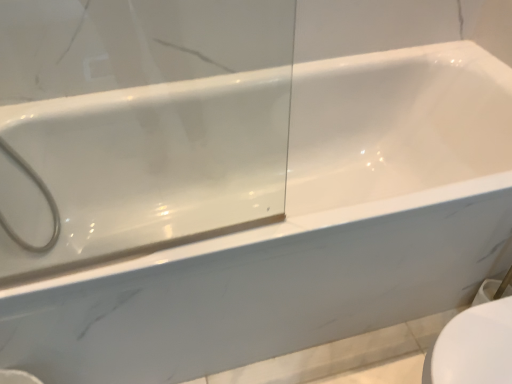
What do you see at coordinates (473, 347) in the screenshot? I see `white glossy toilet bowl at lower right` at bounding box center [473, 347].

Identify the location of white glossy toilet bowl at lower right. The image size is (512, 384). (473, 347).

What do you see at coordinates (44, 196) in the screenshot? I see `white matte showerhead at left` at bounding box center [44, 196].

The width and height of the screenshot is (512, 384). I want to click on white matte showerhead at left, so click(x=44, y=196).

Where is `white glossy toilet bowl at lower right`? The image size is (512, 384). white glossy toilet bowl at lower right is located at coordinates (473, 347).

Considering the positions of objects white matte showerhead at left and white glossy toilet bowl at lower right in the image provided, who is more to the left, white matte showerhead at left or white glossy toilet bowl at lower right?

From the viewer's perspective, white matte showerhead at left appears more on the left side.

Which object is closer to the camera taking this photo, white matte showerhead at left or white glossy toilet bowl at lower right?

white glossy toilet bowl at lower right is in front.

Which is in front, point (5, 224) or point (510, 378)?

The point (510, 378) is closer to the camera.

From the image's perspective, which one is positioned higher, white matte showerhead at left or white glossy toilet bowl at lower right?

white matte showerhead at left, from the image's perspective.

From a real-world perspective, which object stands above the other?

In real-world perspective, white matte showerhead at left is above.

Which of these two, white matte showerhead at left or white glossy toilet bowl at lower right, is thinner?

Thinner between the two is white matte showerhead at left.

Can you confirm if white matte showerhead at left is taller than white glossy toilet bowl at lower right?

Correct, white matte showerhead at left is much taller as white glossy toilet bowl at lower right.

Between white matte showerhead at left and white glossy toilet bowl at lower right, which one has smaller size?

With smaller size is white matte showerhead at left.

Is white matte showerhead at left completely or partially outside of white glossy toilet bowl at lower right?

Yes.

Would you consider white matte showerhead at left to be distant from white glossy toilet bowl at lower right?

Yes, white matte showerhead at left and white glossy toilet bowl at lower right are quite far apart.

Is white matte showerhead at left positioned with its back to white glossy toilet bowl at lower right?

No, white matte showerhead at left is not facing away from white glossy toilet bowl at lower right.

In order to click on shower behind the white glossy toilet bowl at lower right in this screenshot , I will do `click(44, 196)`.

Which object is positioned more to the left, white glossy toilet bowl at lower right or white matte showerhead at left?

From the viewer's perspective, white matte showerhead at left appears more on the left side.

Considering the positions of objects white glossy toilet bowl at lower right and white matte showerhead at left in the image provided, who is behind, white glossy toilet bowl at lower right or white matte showerhead at left?

white matte showerhead at left is behind.

Considering the points (449, 350) and (35, 173), which point is in front, point (449, 350) or point (35, 173)?

Point (449, 350)

From the image's perspective, which is above, white glossy toilet bowl at lower right or white matte showerhead at left?

white matte showerhead at left is shown above in the image.

From a real-world perspective, between white glossy toilet bowl at lower right and white matte showerhead at left, who is vertically lower?

In real-world perspective, white glossy toilet bowl at lower right is lower.

Does white glossy toilet bowl at lower right have a lesser width compared to white matte showerhead at left?

No.

Who is shorter, white glossy toilet bowl at lower right or white matte showerhead at left?

With less height is white glossy toilet bowl at lower right.

Is white glossy toilet bowl at lower right bigger or smaller than white matte showerhead at left?

Clearly, white glossy toilet bowl at lower right is larger in size than white matte showerhead at left.

Is white glossy toilet bowl at lower right positioned beyond the bounds of white matte showerhead at left?

Absolutely, white glossy toilet bowl at lower right is external to white matte showerhead at left.

Is white glossy toilet bowl at lower right with white matte showerhead at left?

No, white glossy toilet bowl at lower right is not making contact with white matte showerhead at left.

Is white glossy toilet bowl at lower right turned away from white matte showerhead at left?

No, white glossy toilet bowl at lower right is not facing away from white matte showerhead at left.

What's the angular difference between white glossy toilet bowl at lower right and white matte showerhead at left's facing directions?

180 degrees.

Image resolution: width=512 pixels, height=384 pixels. Find the location of `toilet bowl in front of the white matte showerhead at left`. toilet bowl in front of the white matte showerhead at left is located at coordinates (473, 347).

The image size is (512, 384). Identify the location of toilet bowl below the white matte showerhead at left (from a real-world perspective). (473, 347).

In order to click on shower located above the white glossy toilet bowl at lower right (from the image's perspective) in this screenshot , I will do point(44,196).